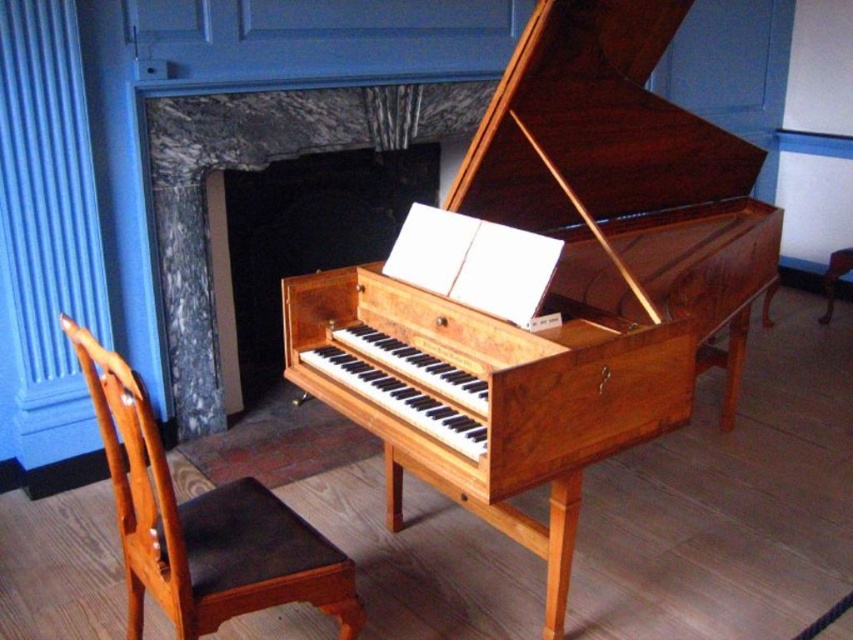
Is shiny brown wood harpsichord at center closer to camera compared to mahogany wood chair at lower left?

That is False.

Which is more to the right, shiny brown wood harpsichord at center or mahogany wood chair at lower left?

Positioned to the right is shiny brown wood harpsichord at center.

Between point (724, 317) and point (173, 554), which one is positioned behind?

Positioned behind is point (724, 317).

Where is `shiny brown wood harpsichord at center`? This screenshot has width=853, height=640. shiny brown wood harpsichord at center is located at coordinates (556, 285).

Can you confirm if mahogany wood chair at lower left is thinner than brown wooden stool at lower right?

In fact, mahogany wood chair at lower left might be wider than brown wooden stool at lower right.

Does mahogany wood chair at lower left appear over brown wooden stool at lower right?

No, mahogany wood chair at lower left is not above brown wooden stool at lower right.

Which is in front, point (267, 604) or point (850, 264)?

Point (267, 604) is in front.

In order to click on mahogany wood chair at lower left in this screenshot , I will do `click(201, 524)`.

Is shiny brown wood harpsichord at center thinner than brown wooden stool at lower right?

In fact, shiny brown wood harpsichord at center might be wider than brown wooden stool at lower right.

Image resolution: width=853 pixels, height=640 pixels. What do you see at coordinates (556, 285) in the screenshot?
I see `shiny brown wood harpsichord at center` at bounding box center [556, 285].

Identify the location of shiny brown wood harpsichord at center. (556, 285).

Identify the location of shiny brown wood harpsichord at center. (556, 285).